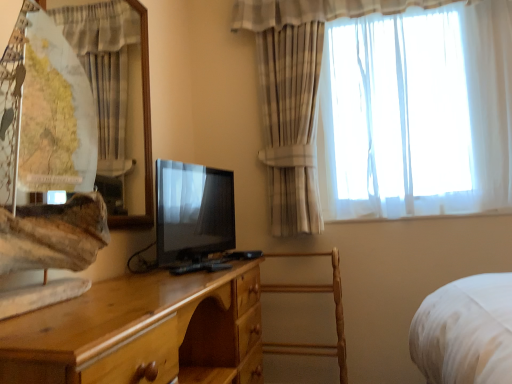
Question: Is light brown wood chest of drawers at center turned away from white sheer curtain at upper left, which is the 1th curtain in front-to-back order?

Choices:
 (A) no
 (B) yes

Answer: (A)

Question: Is light brown wood chest of drawers at center not close to white sheer curtain at upper left, acting as the first curtain starting from the left?

Choices:
 (A) no
 (B) yes

Answer: (B)

Question: Considering the relative sizes of light brown wood chest of drawers at center and white sheer curtain at upper left, which is the 1th curtain in front-to-back order, in the image provided, is light brown wood chest of drawers at center shorter than white sheer curtain at upper left, which is the 1th curtain in front-to-back order,?

Choices:
 (A) yes
 (B) no

Answer: (A)

Question: Is light brown wood chest of drawers at center oriented towards white sheer curtain at upper left, which ranks as the second curtain in right-to-left order?

Choices:
 (A) yes
 (B) no

Answer: (B)

Question: Is light brown wood chest of drawers at center positioned before white sheer curtain at upper left, positioned as the 2th curtain in back-to-front order?

Choices:
 (A) no
 (B) yes

Answer: (B)

Question: Can white sheer curtain at upper left, positioned as the 2th curtain in back-to-front order, be found inside light brown wood chest of drawers at center?

Choices:
 (A) no
 (B) yes

Answer: (A)

Question: From a real-world perspective, is matte black tv at center on sheer white curtain at upper right, marked as the 1th curtain in a right-to-left arrangement?

Choices:
 (A) yes
 (B) no

Answer: (B)

Question: Does matte black tv at center have a greater width compared to sheer white curtain at upper right, the first curtain in the back-to-front sequence?

Choices:
 (A) no
 (B) yes

Answer: (A)

Question: Is matte black tv at center at the right side of sheer white curtain at upper right, the first curtain in the back-to-front sequence?

Choices:
 (A) no
 (B) yes

Answer: (A)

Question: Can you confirm if matte black tv at center is shorter than sheer white curtain at upper right, marked as the 1th curtain in a right-to-left arrangement?

Choices:
 (A) no
 (B) yes

Answer: (B)

Question: Can you confirm if matte black tv at center is taller than sheer white curtain at upper right, the second curtain from the left?

Choices:
 (A) no
 (B) yes

Answer: (A)

Question: Can you confirm if matte black tv at center is positioned to the left of sheer white curtain at upper right, marked as the 1th curtain in a right-to-left arrangement?

Choices:
 (A) yes
 (B) no

Answer: (A)

Question: Is the depth of wooden armchair at center less than that of light brown wood chest of drawers at center?

Choices:
 (A) no
 (B) yes

Answer: (A)